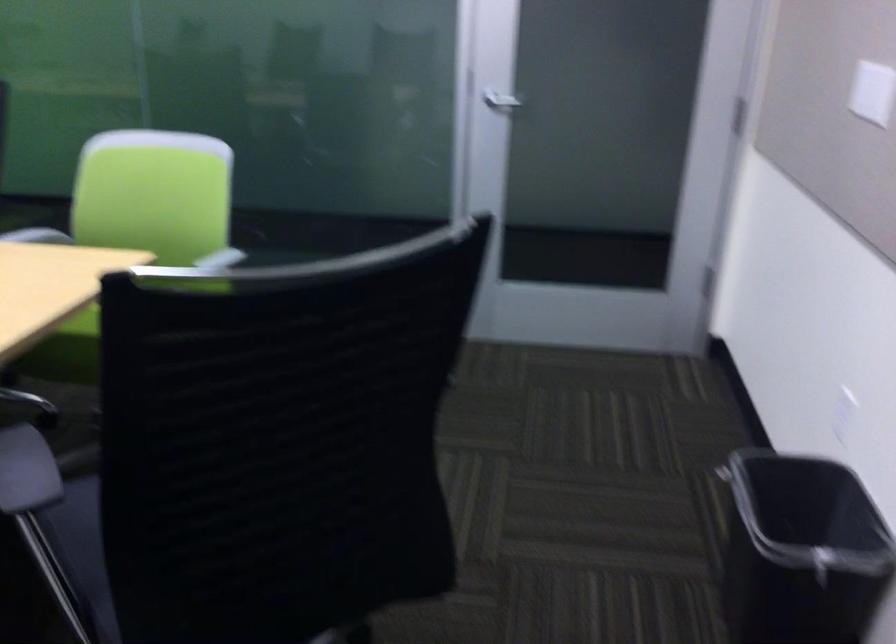
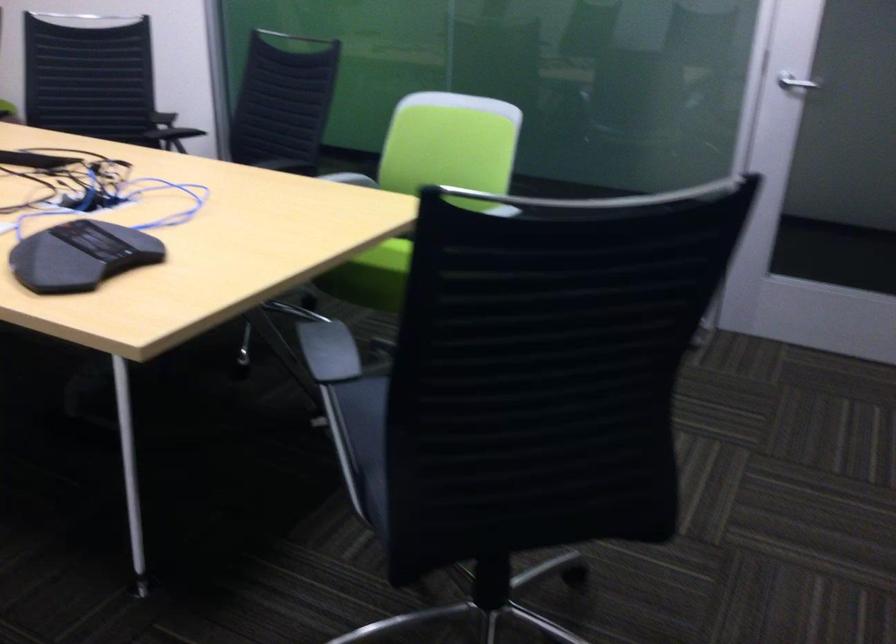
The images are taken continuously from a first-person perspective. In which direction are you moving?

The cameraman walked toward right, backward.